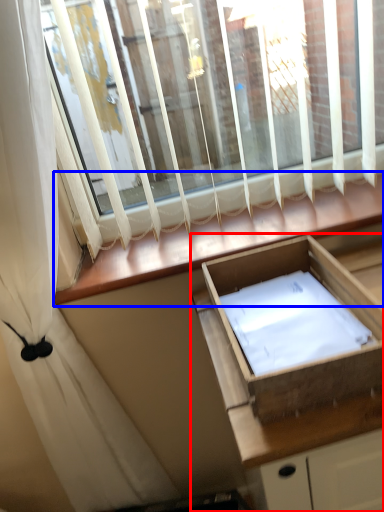
Question: Which point is closer to the camera, cabinetry (highlighted by a red box) or window sill (highlighted by a blue box)?

Choices:
 (A) cabinetry
 (B) window sill

Answer: (A)